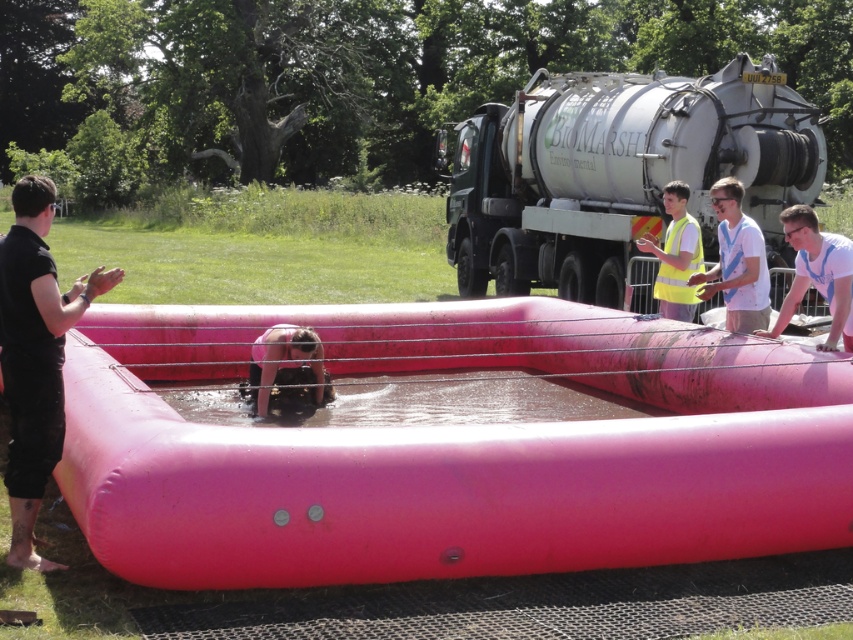
Question: Does rubber/inflatable raft at center have a greater width compared to black matte shirt at left?

Choices:
 (A) yes
 (B) no

Answer: (A)

Question: Which point is farther to the camera?

Choices:
 (A) yellow reflective vest at center
 (B) rubber/inflatable raft at center
 (C) yellow reflective safety vest at right

Answer: (A)

Question: Is black matte shirt at left below yellow reflective safety vest at right?

Choices:
 (A) yes
 (B) no

Answer: (A)

Question: Which point is closer to the camera?

Choices:
 (A) white t-shirt at upper right
 (B) yellow reflective safety vest at right

Answer: (A)

Question: Which object is the farthest from the black matte shirt at left?

Choices:
 (A) white cotton shirt at right
 (B) matte black construction worker at center
 (C) yellow reflective safety vest at right

Answer: (C)

Question: Is white cotton shirt at right smaller than yellow reflective safety vest at right?

Choices:
 (A) yes
 (B) no

Answer: (B)